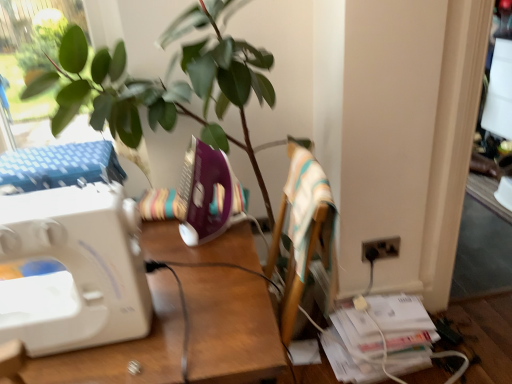
Image resolution: width=512 pixels, height=384 pixels. What are the coordinates of `purple plastic sewing machine at center, the second sewing machine when ordered from left to right` in the screenshot? It's located at (206, 194).

How much space does white plastic sewing machine at left, the first sewing machine viewed from the left, occupy vertically?

It is 12.13 inches.

Locate an element on the screen. purple plastic sewing machine at center, which is the first sewing machine in right-to-left order is located at coordinates (206, 194).

Is black plastic electric outlet at lower right not inside white plastic sewing machine at left, placed as the 2th sewing machine when sorted from right to left?

Yes, black plastic electric outlet at lower right is outside of white plastic sewing machine at left, placed as the 2th sewing machine when sorted from right to left.

Considering the sizes of objects black plastic electric outlet at lower right and white plastic sewing machine at left, the first sewing machine when ordered from front to back, in the image provided, who is bigger, black plastic electric outlet at lower right or white plastic sewing machine at left, the first sewing machine when ordered from front to back,?

white plastic sewing machine at left, the first sewing machine when ordered from front to back, is bigger.

Relative to white plastic sewing machine at left, the first sewing machine viewed from the left, is black plastic electric outlet at lower right in front or behind?

Clearly, black plastic electric outlet at lower right is behind white plastic sewing machine at left, the first sewing machine viewed from the left.

Could you tell me if black plastic electric outlet at lower right is turned towards white plastic sewing machine at left, the 2th sewing machine in the back-to-front sequence?

No, black plastic electric outlet at lower right is not aimed at white plastic sewing machine at left, the 2th sewing machine in the back-to-front sequence.

Considering the sizes of objects black plastic electric outlet at lower right and striped fabric armchair at center in the image provided, who is thinner, black plastic electric outlet at lower right or striped fabric armchair at center?

With smaller width is black plastic electric outlet at lower right.

From the image's perspective, which one is positioned higher, black plastic electric outlet at lower right or striped fabric armchair at center?

striped fabric armchair at center appears higher in the image.

Is black plastic electric outlet at lower right outside of striped fabric armchair at center?

Yes, black plastic electric outlet at lower right is not within striped fabric armchair at center.

How different are the orientations of black plastic electric outlet at lower right and striped fabric armchair at center in degrees?

black plastic electric outlet at lower right and striped fabric armchair at center are facing 86.2 degrees away from each other.

Can you tell me how much striped fabric armchair at center and purple plastic sewing machine at center, which is the first sewing machine in right-to-left order, differ in facing direction?

striped fabric armchair at center and purple plastic sewing machine at center, which is the first sewing machine in right-to-left order, are facing 90 degrees away from each other.

In the scene shown: Can you see striped fabric armchair at center touching purple plastic sewing machine at center, arranged as the first sewing machine when viewed from the back?

striped fabric armchair at center is not next to purple plastic sewing machine at center, arranged as the first sewing machine when viewed from the back, and they're not touching.

Is purple plastic sewing machine at center, arranged as the first sewing machine when viewed from the back, located within striped fabric armchair at center?

That's incorrect, purple plastic sewing machine at center, arranged as the first sewing machine when viewed from the back, is not inside striped fabric armchair at center.

At what (x,y) coordinates should I click in order to perform the action: click on armchair below the purple plastic sewing machine at center, arranged as the first sewing machine when viewed from the back (from a real-world perspective). Please return your answer as a coordinate pair (x, y). This screenshot has height=384, width=512. Looking at the image, I should click on (302, 230).

Looking at this image, considering the relative sizes of purple plastic sewing machine at center, the second sewing machine when ordered from left to right, and striped fabric armchair at center in the image provided, is purple plastic sewing machine at center, the second sewing machine when ordered from left to right, wider than striped fabric armchair at center?

No.

Is point (229, 164) farther from viewer compared to point (336, 274)?

That is False.

Would you say purple plastic sewing machine at center, the second sewing machine when ordered from left to right, is inside or outside striped fabric armchair at center?

purple plastic sewing machine at center, the second sewing machine when ordered from left to right, is outside striped fabric armchair at center.

Considering their positions, is purple plastic sewing machine at center, arranged as the first sewing machine when viewed from the back, located in front of or behind striped fabric armchair at center?

purple plastic sewing machine at center, arranged as the first sewing machine when viewed from the back, is behind striped fabric armchair at center.

Is white plastic sewing machine at left completely or partially outside of purple plastic sewing machine at center, arranged as the first sewing machine when viewed from the back?

white plastic sewing machine at left is positioned outside purple plastic sewing machine at center, arranged as the first sewing machine when viewed from the back.

Consider the image. Looking at their sizes, would you say white plastic sewing machine at left is wider or thinner than purple plastic sewing machine at center, acting as the 2th sewing machine starting from the front?

Considering their sizes, white plastic sewing machine at left looks broader than purple plastic sewing machine at center, acting as the 2th sewing machine starting from the front.

From the image's perspective, between white plastic sewing machine at left and purple plastic sewing machine at center, which is the first sewing machine in right-to-left order, who is located below?

From the image's view, white plastic sewing machine at left is below.

Between purple plastic sewing machine at center, acting as the 2th sewing machine starting from the front, and white plastic sewing machine at left, which one has more height?

Standing taller between the two is white plastic sewing machine at left.

Which object is thinner, purple plastic sewing machine at center, the second sewing machine when ordered from left to right, or white plastic sewing machine at left?

With smaller width is purple plastic sewing machine at center, the second sewing machine when ordered from left to right.

Consider the image. Is purple plastic sewing machine at center, which is the first sewing machine in right-to-left order, at the left side of white plastic sewing machine at left?

In fact, purple plastic sewing machine at center, which is the first sewing machine in right-to-left order, is to the right of white plastic sewing machine at left.

From the image's perspective, relative to white plastic sewing machine at left, is purple plastic sewing machine at center, the second sewing machine when ordered from left to right, above or below?

purple plastic sewing machine at center, the second sewing machine when ordered from left to right, is situated higher than white plastic sewing machine at left in the image.

From the image's perspective, between black plastic electric outlet at lower right and white plastic sewing machine at left, which one is located above?

black plastic electric outlet at lower right.

From a real-world perspective, is black plastic electric outlet at lower right over white plastic sewing machine at left?

Yes, from a real-world perspective, black plastic electric outlet at lower right is above white plastic sewing machine at left.

Are black plastic electric outlet at lower right and white plastic sewing machine at left located far from each other?

Actually, black plastic electric outlet at lower right and white plastic sewing machine at left are a little close together.

You are a GUI agent. You are given a task and a screenshot of the screen. Output one action in this format:
    pyautogui.click(x=<x>, y=<y>)
    Task: Click on the electric outlet below the white plastic sewing machine at left, placed as the 2th sewing machine when sorted from right to left (from the image's perspective)
    This screenshot has width=512, height=384.
    Given the screenshot: What is the action you would take?
    pyautogui.click(x=382, y=247)

At what (x,y) coordinates should I click in order to perform the action: click on electric outlet on the right of the striped fabric armchair at center. Please return your answer as a coordinate pair (x, y). This screenshot has height=384, width=512. Looking at the image, I should click on (382, 247).

Estimate the real-world distances between objects in this image. Which object is further from black plastic electric outlet at lower right, white plastic sewing machine at left, the first sewing machine viewed from the left, or purple plastic sewing machine at center, acting as the 2th sewing machine starting from the front?

white plastic sewing machine at left, the first sewing machine viewed from the left, is further to black plastic electric outlet at lower right.

Based on their spatial positions, is black plastic electric outlet at lower right or white plastic sewing machine at left closer to purple plastic sewing machine at center, the second sewing machine when ordered from left to right?

white plastic sewing machine at left is closer to purple plastic sewing machine at center, the second sewing machine when ordered from left to right.

Based on their spatial positions, is black plastic electric outlet at lower right or white plastic sewing machine at left, the first sewing machine viewed from the left, closer to purple plastic sewing machine at center, arranged as the first sewing machine when viewed from the back?

The object closer to purple plastic sewing machine at center, arranged as the first sewing machine when viewed from the back, is white plastic sewing machine at left, the first sewing machine viewed from the left.

From the image, which object appears to be nearer to white plastic sewing machine at left, the first sewing machine viewed from the left, striped fabric armchair at center or white plastic sewing machine at left?

white plastic sewing machine at left is positioned closer to the anchor white plastic sewing machine at left, the first sewing machine viewed from the left.

Based on their spatial positions, is striped fabric armchair at center or white plastic sewing machine at left closer to black plastic electric outlet at lower right?

striped fabric armchair at center is closer to black plastic electric outlet at lower right.

Looking at the image, which one is located further to white plastic sewing machine at left, the first sewing machine when ordered from front to back, black plastic electric outlet at lower right or white plastic sewing machine at left?

Based on the image, black plastic electric outlet at lower right appears to be further to white plastic sewing machine at left, the first sewing machine when ordered from front to back.

Estimate the real-world distances between objects in this image. Which object is closer to white plastic sewing machine at left, black plastic electric outlet at lower right or striped fabric armchair at center?

striped fabric armchair at center is positioned closer to the anchor white plastic sewing machine at left.

Based on their spatial positions, is white plastic sewing machine at left or black plastic electric outlet at lower right closer to white plastic sewing machine at left, the 2th sewing machine in the back-to-front sequence?

white plastic sewing machine at left lies closer to white plastic sewing machine at left, the 2th sewing machine in the back-to-front sequence, than the other object.

Where is `sewing machine between white plastic sewing machine at left, the first sewing machine when ordered from front to back, and striped fabric armchair at center`? This screenshot has width=512, height=384. sewing machine between white plastic sewing machine at left, the first sewing machine when ordered from front to back, and striped fabric armchair at center is located at coordinates tap(206, 194).

Where is `sewing machine between white plastic sewing machine at left, the 2th sewing machine in the back-to-front sequence, and black plastic electric outlet at lower right, along the z-axis`? The width and height of the screenshot is (512, 384). sewing machine between white plastic sewing machine at left, the 2th sewing machine in the back-to-front sequence, and black plastic electric outlet at lower right, along the z-axis is located at coordinates (206, 194).

Identify the location of armchair between white plastic sewing machine at left and black plastic electric outlet at lower right from front to back. (302, 230).

This screenshot has height=384, width=512. Find the location of `armchair between white plastic sewing machine at left, the first sewing machine viewed from the left, and black plastic electric outlet at lower right, along the z-axis`. armchair between white plastic sewing machine at left, the first sewing machine viewed from the left, and black plastic electric outlet at lower right, along the z-axis is located at coordinates (302, 230).